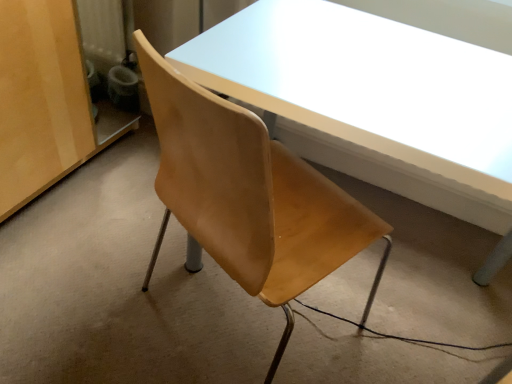
Question: Is matte wood cabinet at left thinner than matte white table at center?

Choices:
 (A) no
 (B) yes

Answer: (A)

Question: Can you confirm if matte wood cabinet at left is positioned to the right of matte white table at center?

Choices:
 (A) yes
 (B) no

Answer: (B)

Question: From a real-world perspective, is matte wood cabinet at left on matte white table at center?

Choices:
 (A) no
 (B) yes

Answer: (A)

Question: Does matte wood cabinet at left appear on the left side of matte white table at center?

Choices:
 (A) no
 (B) yes

Answer: (B)

Question: Does matte wood cabinet at left have a larger size compared to matte white table at center?

Choices:
 (A) yes
 (B) no

Answer: (B)

Question: Is matte wood cabinet at left oriented away from matte white table at center?

Choices:
 (A) yes
 (B) no

Answer: (B)

Question: From the image's perspective, is wooden chair at center on top of matte wood cabinet at left?

Choices:
 (A) no
 (B) yes

Answer: (A)

Question: Can you confirm if wooden chair at center is taller than matte wood cabinet at left?

Choices:
 (A) yes
 (B) no

Answer: (B)

Question: Is wooden chair at center with matte wood cabinet at left?

Choices:
 (A) yes
 (B) no

Answer: (B)

Question: Would you say matte wood cabinet at left is part of wooden chair at center's contents?

Choices:
 (A) yes
 (B) no

Answer: (B)

Question: Does wooden chair at center have a larger size compared to matte wood cabinet at left?

Choices:
 (A) no
 (B) yes

Answer: (A)

Question: Considering the relative positions of wooden chair at center and matte wood cabinet at left in the image provided, is wooden chair at center behind matte wood cabinet at left?

Choices:
 (A) yes
 (B) no

Answer: (B)

Question: Can wooden chair at center be found inside matte white table at center?

Choices:
 (A) yes
 (B) no

Answer: (B)